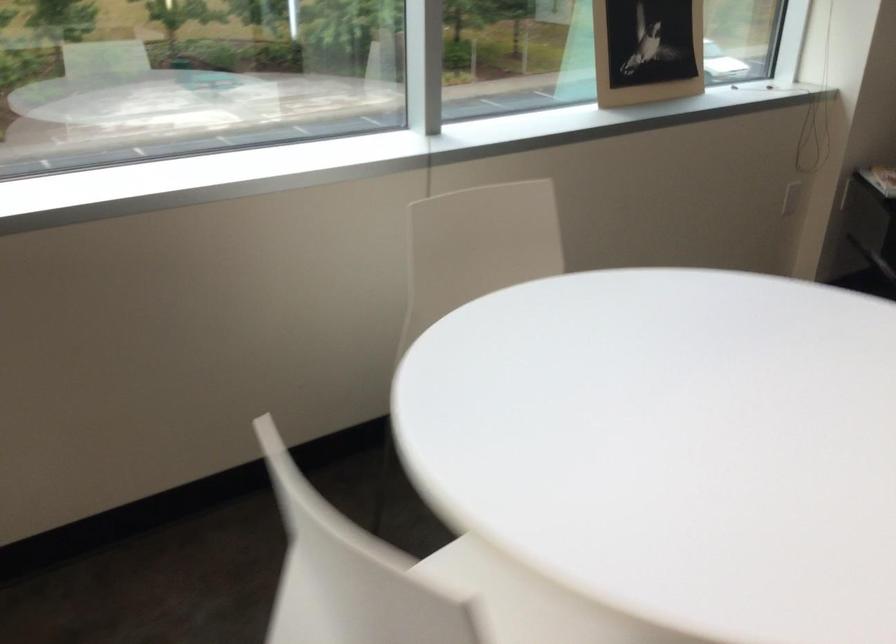
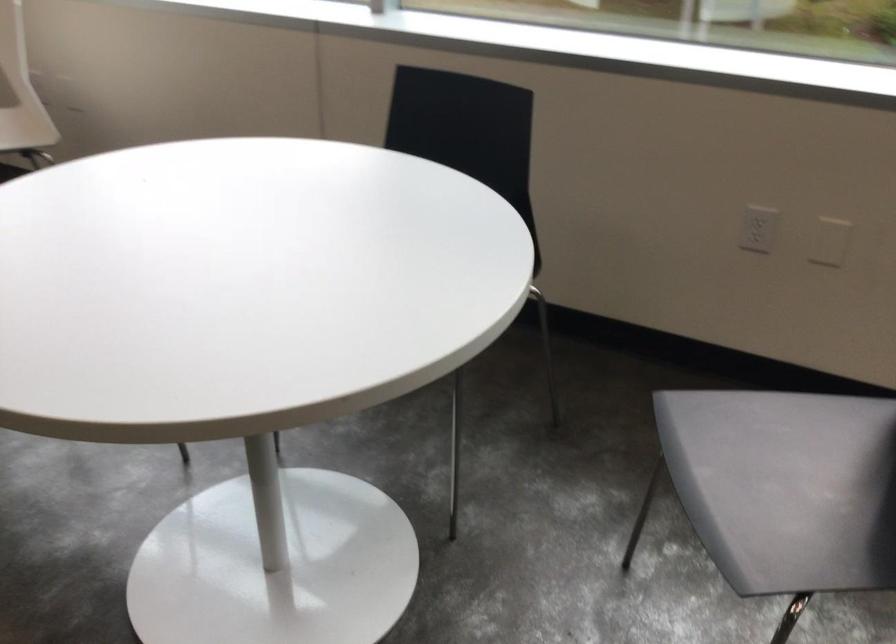
From the picture: The images are taken continuously from a first-person perspective. In which direction is your viewpoint rotating?

The rotation direction of the camera is left-down.